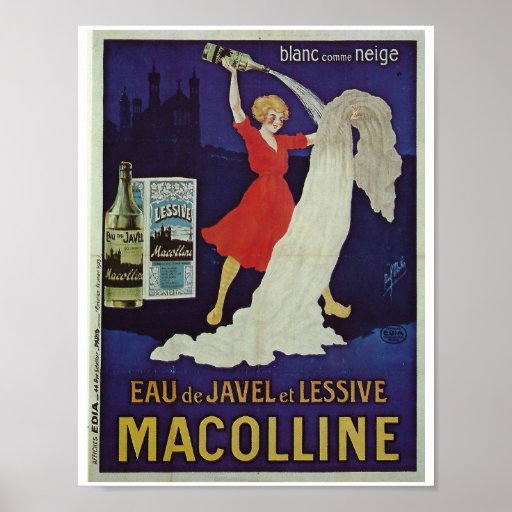
Locate an element on the screen. This screenshot has height=512, width=512. bottle is located at coordinates (217, 52).